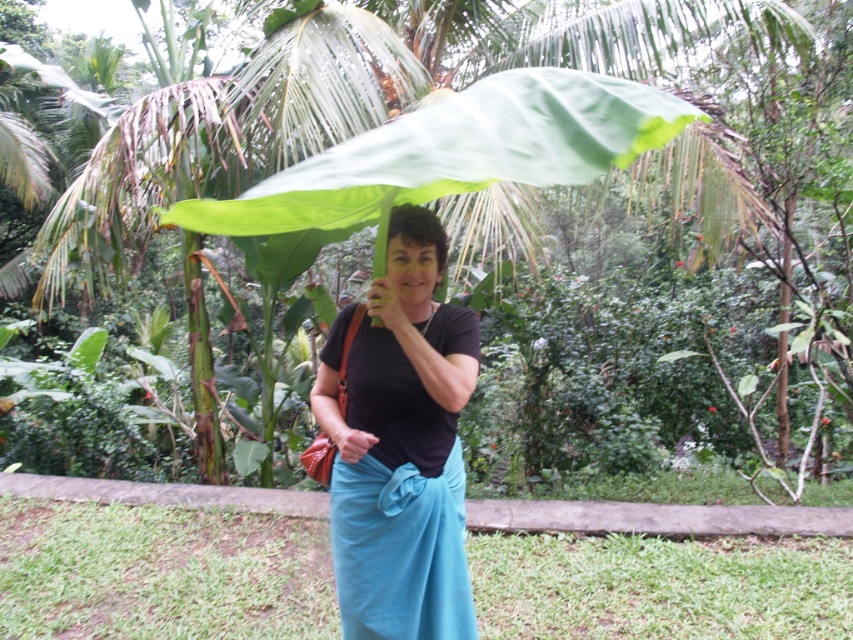
Who is more distant from viewer, [387,390] or [616,148]?

Point [387,390]

The image size is (853, 640). What do you see at coordinates (399, 445) in the screenshot? I see `black matte shirt at center` at bounding box center [399, 445].

Is point (358, 380) less distant than point (511, 72)?

No, it is not.

Where is `black matte shirt at center`? This screenshot has height=640, width=853. black matte shirt at center is located at coordinates (399, 445).

Is black matte shirt at center above matte blue fabric at lower center?

Indeed, black matte shirt at center is positioned over matte blue fabric at lower center.

Where is `black matte shirt at center`? The height and width of the screenshot is (640, 853). black matte shirt at center is located at coordinates (399, 445).

Locate an element on the screen. Image resolution: width=853 pixels, height=640 pixels. black matte shirt at center is located at coordinates (399, 445).

Does green leafy umbrella at center have a larger size compared to matte blue fabric at lower center?

Correct, green leafy umbrella at center is larger in size than matte blue fabric at lower center.

Which of these two, green leafy umbrella at center or matte blue fabric at lower center, stands taller?

matte blue fabric at lower center is taller.

Describe the element at coordinates (456, 154) in the screenshot. I see `green leafy umbrella at center` at that location.

At what (x,y) coordinates should I click in order to perform the action: click on green leafy umbrella at center. Please return your answer as a coordinate pair (x, y). Looking at the image, I should click on (456, 154).